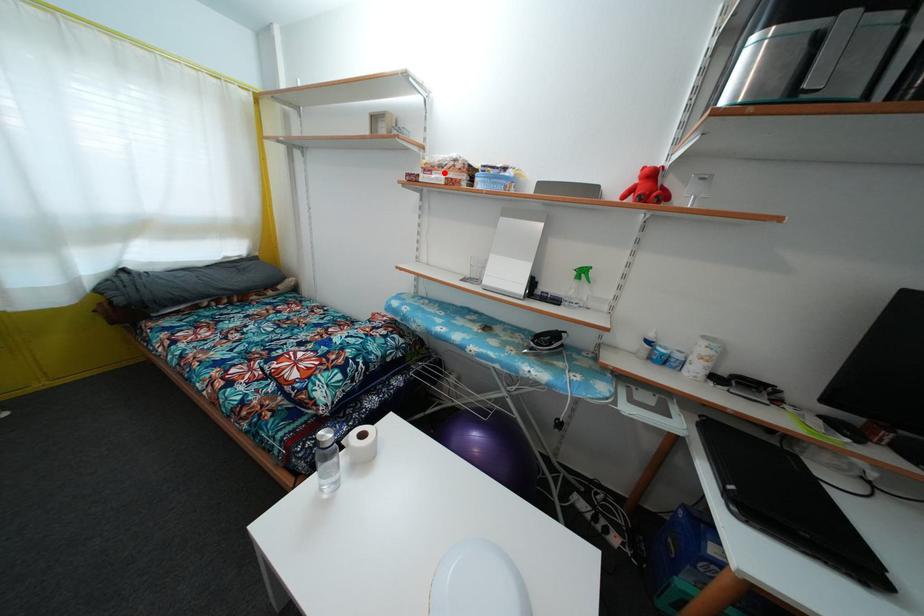
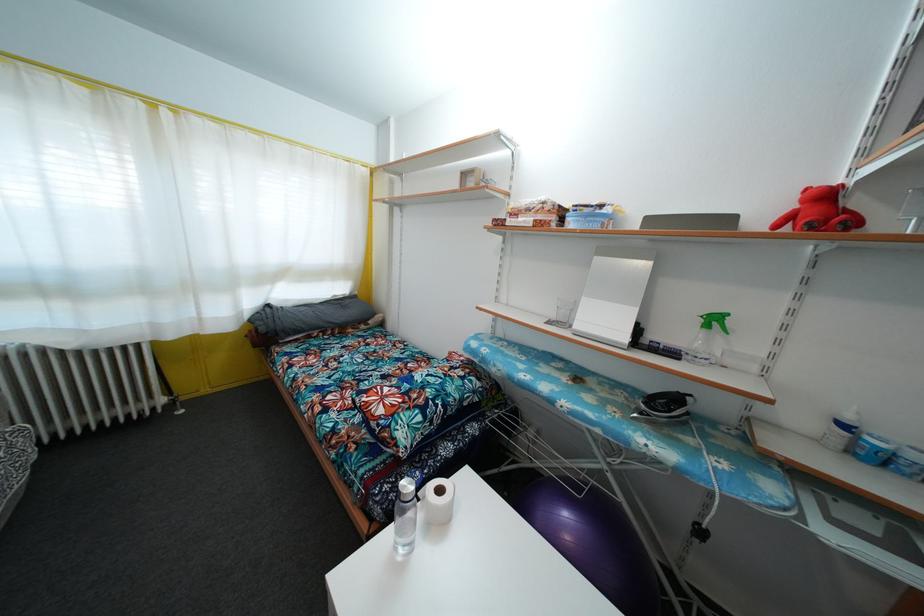
The point at the highlighted location is marked in the first image. Where is the corresponding point in the second image?

(531, 216)